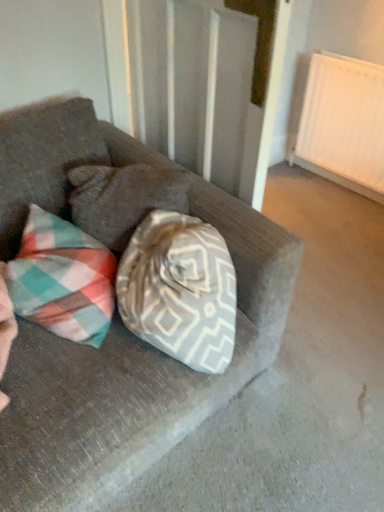
Question: From a real-world perspective, relative to suede couch at center, is white textured curtain at upper center vertically above or below?

Choices:
 (A) above
 (B) below

Answer: (A)

Question: Looking at the image, does white textured curtain at upper center seem bigger or smaller compared to suede couch at center?

Choices:
 (A) small
 (B) big

Answer: (A)

Question: Estimate the real-world distances between objects in this image. Which object is farther from the suede couch at center?

Choices:
 (A) white matte radiator at upper right
 (B) white textured curtain at upper center
 (C) plaid fabric pillow at center

Answer: (A)

Question: Based on their relative distances, which object is nearer to the white textured curtain at upper center?

Choices:
 (A) white matte radiator at upper right
 (B) suede couch at center
 (C) plaid fabric pillow at center

Answer: (C)